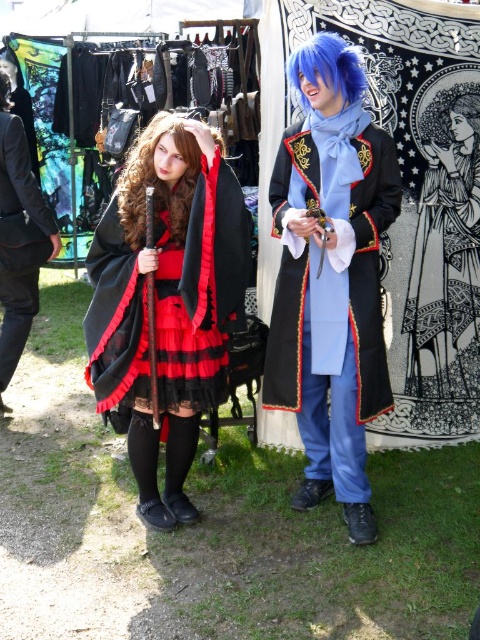
Is black leather jacket at center smaller than blue synthetic wig at upper center?

No.

Does point (25, 308) come behind point (356, 77)?

That is True.

The image size is (480, 640). Find the location of `black leather jacket at center`. black leather jacket at center is located at coordinates (23, 182).

Between point (455, 282) and point (36, 188), which one is positioned behind?

The point (36, 188) is behind.

How distant is black velvet dress at center from black leather jacket at center?

They are 7.96 feet apart.

Measure the distance between point (471, 282) and camera.

Point (471, 282) and camera are 3.85 meters apart from each other.

Locate an element on the screen. The height and width of the screenshot is (640, 480). black velvet dress at center is located at coordinates (445, 250).

Is velvet black cape at center taller than black leather jacket at center?

Yes, velvet black cape at center is taller than black leather jacket at center.

In the scene shown: Does velvet black cape at center appear on the right side of black leather jacket at center?

Correct, you'll find velvet black cape at center to the right of black leather jacket at center.

Where is `velvet black cape at center`? The width and height of the screenshot is (480, 640). velvet black cape at center is located at coordinates (167, 301).